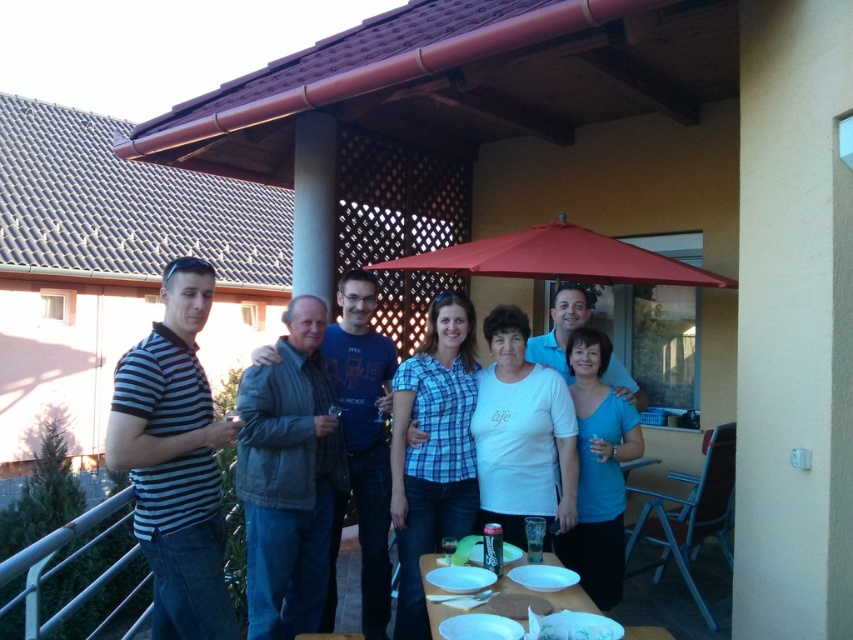
Question: Is striped cotton polo shirt at left wider than blue plaid shirt at center?

Choices:
 (A) yes
 (B) no

Answer: (A)

Question: Which of these objects is positioned farthest from the denim jacket at center?

Choices:
 (A) blue matte shirt at center
 (B) striped cotton polo shirt at left
 (C) red fabric umbrella at upper center
 (D) white plastic table at lower center

Answer: (C)

Question: Which point is closer to the camera taking this photo?

Choices:
 (A) 416,634
 (B) 432,586
 (C) 310,513
 (D) 560,426

Answer: (B)

Question: Is red fabric umbrella at upper center positioned in front of white plastic table at lower center?

Choices:
 (A) yes
 (B) no

Answer: (B)

Question: Can you confirm if red fabric umbrella at upper center is positioned to the right of white plastic table at lower center?

Choices:
 (A) yes
 (B) no

Answer: (A)

Question: Which point is farther to the camera?

Choices:
 (A) (300, 314)
 (B) (492, 310)
 (C) (527, 276)

Answer: (C)